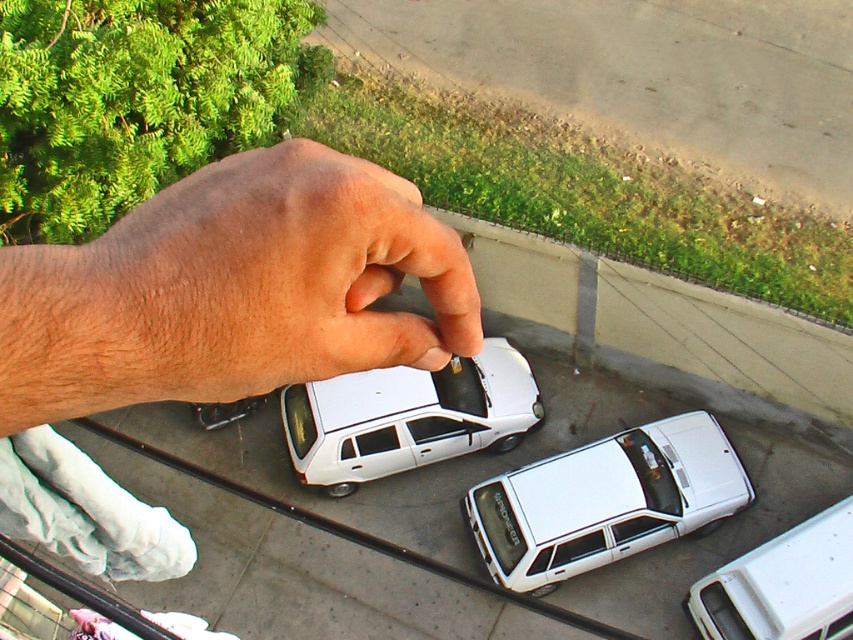
Question: Which point is closer to the camera?

Choices:
 (A) (332, 244)
 (B) (827, 563)

Answer: (A)

Question: Which point is closer to the camera?

Choices:
 (A) white matte station wagon at center
 (B) white matte car at lower right

Answer: (B)

Question: Where is white matte station wagon at center located in relation to white matte car at center in the image?

Choices:
 (A) above
 (B) below

Answer: (B)

Question: Can you confirm if white matte station wagon at center is positioned below white matte car at center?

Choices:
 (A) no
 (B) yes

Answer: (B)

Question: Which point is farther to the camera?

Choices:
 (A) (614, 548)
 (B) (129, 388)
 (C) (302, 476)

Answer: (C)

Question: Can you confirm if dry skin at center is positioned to the right of white matte car at lower right?

Choices:
 (A) yes
 (B) no

Answer: (B)